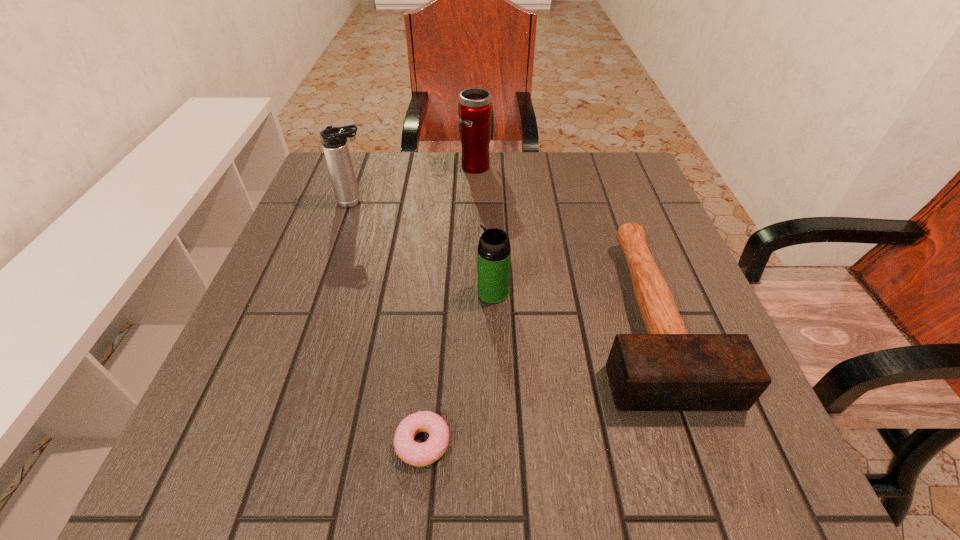
Find the location of a particular element. the farthest thermos bottle is located at coordinates (476, 118).

Where is `the leftmost thermos bottle`? The width and height of the screenshot is (960, 540). the leftmost thermos bottle is located at coordinates (334, 140).

Locate an element on the screen. The height and width of the screenshot is (540, 960). the second farthest thermos bottle is located at coordinates (334, 140).

This screenshot has width=960, height=540. I want to click on the nearest thermos bottle, so click(494, 252).

Image resolution: width=960 pixels, height=540 pixels. I want to click on the third tallest object, so click(x=494, y=252).

The height and width of the screenshot is (540, 960). Identify the location of the rightmost object. (667, 369).

Where is `the fourth tallest object`? The width and height of the screenshot is (960, 540). the fourth tallest object is located at coordinates (667, 369).

At what (x,y) coordinates should I click in order to perform the action: click on doughnut. Please return your answer as a coordinate pair (x, y). This screenshot has width=960, height=540. Looking at the image, I should click on (417, 454).

This screenshot has width=960, height=540. I want to click on the nearest object, so click(x=417, y=454).

This screenshot has width=960, height=540. In order to click on free region located 0.180m on the handle side of the second farthest thermos bottle in this screenshot , I will do `click(445, 202)`.